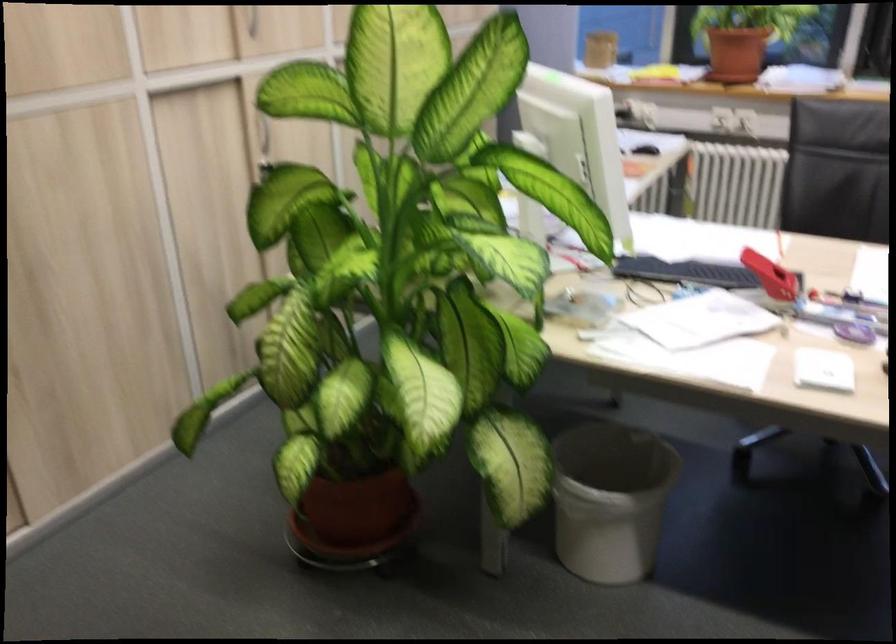
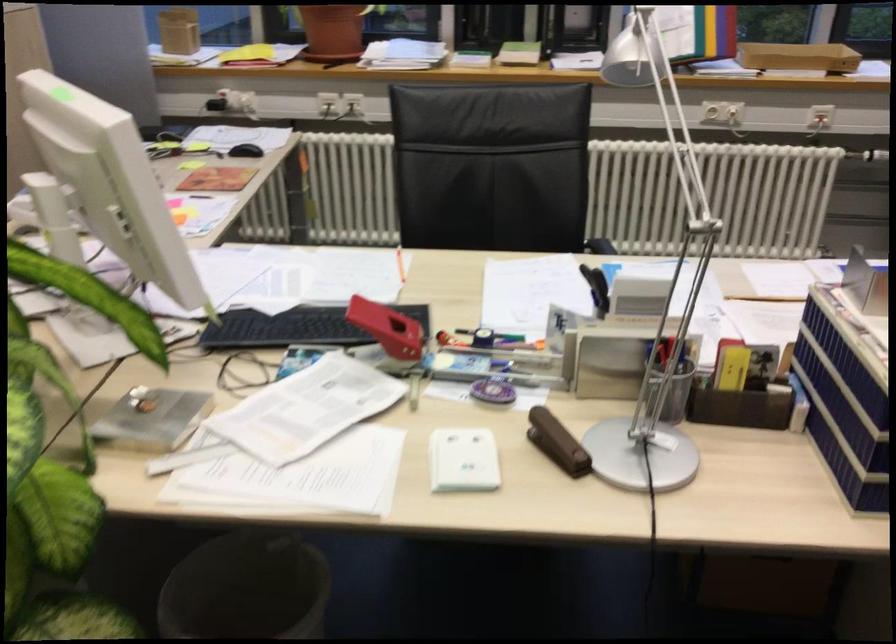
Question: How did the camera likely rotate?

Choices:
 (A) Left
 (B) Right
 (C) Up
 (D) Down

Answer: (B)